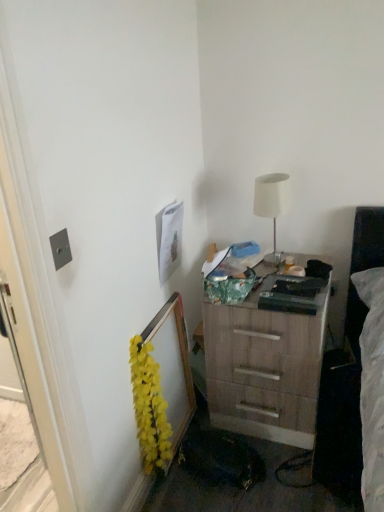
Where is `wooden chest of drawers at lower right`? The image size is (384, 512). wooden chest of drawers at lower right is located at coordinates (266, 365).

The image size is (384, 512). Describe the element at coordinates (272, 204) in the screenshot. I see `white matte table lamp at upper right` at that location.

Find the location of a particular element. Image resolution: width=384 pixels, height=512 pixels. yellow artificial flowers at left is located at coordinates (149, 408).

This screenshot has width=384, height=512. Describe the element at coordinates (149, 408) in the screenshot. I see `yellow artificial flowers at left` at that location.

Image resolution: width=384 pixels, height=512 pixels. Find the location of `wooden chest of drawers at lower right`. wooden chest of drawers at lower right is located at coordinates (266, 365).

Can you tell me how much white matte table lamp at upper right and wooden chest of drawers at lower right differ in facing direction?

The angular difference between white matte table lamp at upper right and wooden chest of drawers at lower right is 0.000718 degrees.

Considering the sizes of white matte table lamp at upper right and wooden chest of drawers at lower right in the image, is white matte table lamp at upper right wider or thinner than wooden chest of drawers at lower right?

In the image, white matte table lamp at upper right appears to be more narrow than wooden chest of drawers at lower right.

Looking at this image, looking at the image, does white matte table lamp at upper right seem bigger or smaller compared to wooden chest of drawers at lower right?

Clearly, white matte table lamp at upper right is smaller in size than wooden chest of drawers at lower right.

Looking at this image, is white matte table lamp at upper right looking in the opposite direction of wooden chest of drawers at lower right?

white matte table lamp at upper right is not turned away from wooden chest of drawers at lower right.

Can you confirm if wooden chest of drawers at lower right is positioned to the right of white matte table lamp at upper right?

Yes.

Is wooden chest of drawers at lower right touching white matte table lamp at upper right?

They are not placed beside each other.

Could white matte table lamp at upper right be considered to be inside wooden chest of drawers at lower right?

No, white matte table lamp at upper right is not surrounded by wooden chest of drawers at lower right.

Locate an element on the screen. the chest of drawers located below the white matte table lamp at upper right (from the image's perspective) is located at coordinates (266, 365).

Is white matte table lamp at upper right not within metallic silver outlet at left?

Yes, white matte table lamp at upper right is outside of metallic silver outlet at left.

Measure the distance between white matte table lamp at upper right and metallic silver outlet at left.

white matte table lamp at upper right is 97.28 centimeters from metallic silver outlet at left.

Is metallic silver outlet at left at the back of white matte table lamp at upper right?

No, white matte table lamp at upper right is not facing the opposite direction of metallic silver outlet at left.

Is white matte table lamp at upper right to the right of metallic silver outlet at left from the viewer's perspective?

Indeed, white matte table lamp at upper right is positioned on the right side of metallic silver outlet at left.

From a real-world perspective, between metallic silver outlet at left and white matte table lamp at upper right, who is vertically higher?

metallic silver outlet at left is physically above.

Can you confirm if metallic silver outlet at left is bigger than white matte table lamp at upper right?

Incorrect, metallic silver outlet at left is not larger than white matte table lamp at upper right.

Can you confirm if metallic silver outlet at left is thinner than white matte table lamp at upper right?

Correct, the width of metallic silver outlet at left is less than that of white matte table lamp at upper right.

Can you confirm if metallic silver outlet at left is thinner than wooden chest of drawers at lower right?

Correct, the width of metallic silver outlet at left is less than that of wooden chest of drawers at lower right.

Is metallic silver outlet at left oriented away from wooden chest of drawers at lower right?

No.

Who is taller, metallic silver outlet at left or wooden chest of drawers at lower right?

wooden chest of drawers at lower right.

From a real-world perspective, which is physically below, metallic silver outlet at left or wooden chest of drawers at lower right?

From a 3D spatial view, wooden chest of drawers at lower right is below.

From the image's perspective, would you say yellow artificial flowers at left is shown under white matte table lamp at upper right?

Indeed, from the image's perspective, yellow artificial flowers at left is shown beneath white matte table lamp at upper right.

Where is `table lamp on the right of yellow artificial flowers at left`? This screenshot has height=512, width=384. table lamp on the right of yellow artificial flowers at left is located at coordinates (272, 204).

Between yellow artificial flowers at left and white matte table lamp at upper right, which one appears on the left side from the viewer's perspective?

Positioned to the left is yellow artificial flowers at left.

Consider the image. Would you say yellow artificial flowers at left is outside white matte table lamp at upper right?

Yes, yellow artificial flowers at left is not within white matte table lamp at upper right.

Considering the relative positions of wooden chest of drawers at lower right and yellow artificial flowers at left in the image provided, is wooden chest of drawers at lower right to the left or to the right of yellow artificial flowers at left?

Based on their positions, wooden chest of drawers at lower right is located to the right of yellow artificial flowers at left.

In terms of size, does wooden chest of drawers at lower right appear bigger or smaller than yellow artificial flowers at left?

wooden chest of drawers at lower right is bigger than yellow artificial flowers at left.

From the image's perspective, which one is positioned lower, wooden chest of drawers at lower right or yellow artificial flowers at left?

yellow artificial flowers at left appears lower in the image.

I want to click on chest of drawers above the yellow artificial flowers at left (from the image's perspective), so click(x=266, y=365).

Find the location of a particular element. the chest of drawers lying below the white matte table lamp at upper right (from the image's perspective) is located at coordinates (266, 365).

Image resolution: width=384 pixels, height=512 pixels. What are the coordinates of `table lamp that is above the wooden chest of drawers at lower right (from the image's perspective)` in the screenshot? It's located at (x=272, y=204).

From the image, which object appears to be farther from white matte table lamp at upper right, wooden chest of drawers at lower right or yellow artificial flowers at left?

yellow artificial flowers at left is further to white matte table lamp at upper right.

Based on their spatial positions, is yellow artificial flowers at left or white matte table lamp at upper right closer to metallic silver outlet at left?

yellow artificial flowers at left is positioned closer to the anchor metallic silver outlet at left.

Looking at the image, which one is located closer to yellow artificial flowers at left, wooden chest of drawers at lower right or white matte table lamp at upper right?

wooden chest of drawers at lower right.

Which object lies further to the anchor point white matte table lamp at upper right, metallic silver outlet at left or yellow artificial flowers at left?

Based on the image, metallic silver outlet at left appears to be further to white matte table lamp at upper right.

Looking at the image, which one is located closer to wooden chest of drawers at lower right, yellow artificial flowers at left or white matte table lamp at upper right?

The object closer to wooden chest of drawers at lower right is white matte table lamp at upper right.

From the image, which object appears to be farther from wooden chest of drawers at lower right, metallic silver outlet at left or yellow artificial flowers at left?

metallic silver outlet at left.

When comparing their distances from metallic silver outlet at left, does wooden chest of drawers at lower right or white matte table lamp at upper right seem closer?

Among the two, white matte table lamp at upper right is located nearer to metallic silver outlet at left.

Which object lies further to the anchor point white matte table lamp at upper right, metallic silver outlet at left or wooden chest of drawers at lower right?

Based on the image, metallic silver outlet at left appears to be further to white matte table lamp at upper right.

Image resolution: width=384 pixels, height=512 pixels. Find the location of `chest of drawers between white matte table lamp at upper right and yellow artificial flowers at left in the vertical direction`. chest of drawers between white matte table lamp at upper right and yellow artificial flowers at left in the vertical direction is located at coordinates (x=266, y=365).

At what (x,y) coordinates should I click in order to perform the action: click on flower between metallic silver outlet at left and wooden chest of drawers at lower right in the horizontal direction. Please return your answer as a coordinate pair (x, y). This screenshot has width=384, height=512. Looking at the image, I should click on (149, 408).

Where is `electric outlet between white matte table lamp at upper right and yellow artificial flowers at left from top to bottom`? The width and height of the screenshot is (384, 512). electric outlet between white matte table lamp at upper right and yellow artificial flowers at left from top to bottom is located at coordinates (60, 249).

Where is `table lamp located between metallic silver outlet at left and wooden chest of drawers at lower right in the left-right direction`? This screenshot has height=512, width=384. table lamp located between metallic silver outlet at left and wooden chest of drawers at lower right in the left-right direction is located at coordinates (272, 204).